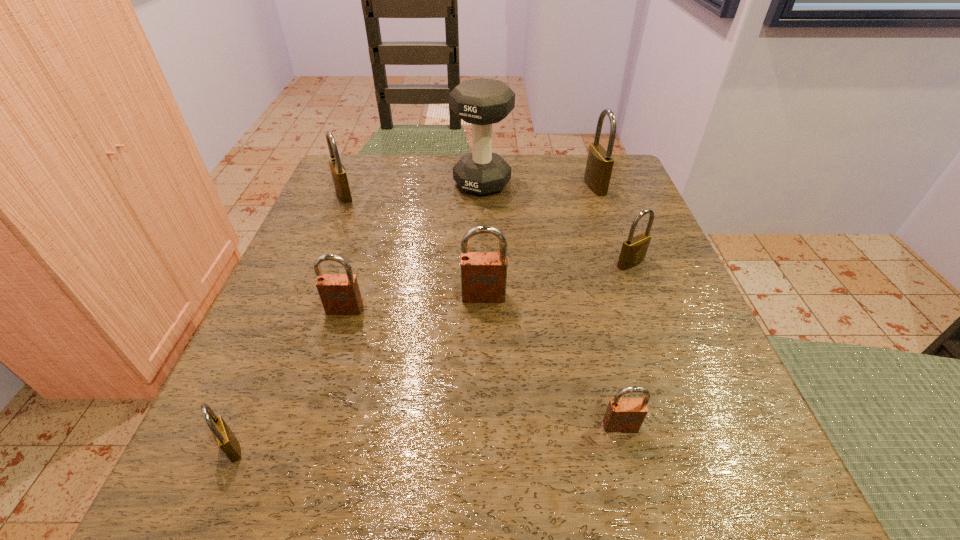
You are a GUI agent. You are given a task and a screenshot of the screen. Output one action in this format:
    pyautogui.click(x=<x>, y=<y>)
    Task: Click on the tallest object
    
    Given the screenshot: What is the action you would take?
    pyautogui.click(x=481, y=102)

At what (x,y) coordinates should I click in order to perform the action: click on gray dumbbell. Please return your answer as a coordinate pair (x, y). This screenshot has height=540, width=960. Looking at the image, I should click on (481, 102).

Where is `the seventh shortest object`? Image resolution: width=960 pixels, height=540 pixels. the seventh shortest object is located at coordinates point(599,165).

I want to click on the tallest padlock, so click(x=599, y=165).

Locate an element on the screen. the third smallest brass padlock is located at coordinates (338, 171).

At what (x,y) coordinates should I click in order to perform the action: click on the farthest brown padlock. Please return your answer as a coordinate pair (x, y). The width and height of the screenshot is (960, 540). Looking at the image, I should click on (483, 274).

Where is `the fourth farthest padlock`? The height and width of the screenshot is (540, 960). the fourth farthest padlock is located at coordinates (483, 274).

The image size is (960, 540). In order to click on the third nearest object in this screenshot , I will do `click(340, 295)`.

Locate an element on the screen. The width and height of the screenshot is (960, 540). the sixth object from right to left is located at coordinates (340, 295).

At what (x,y) coordinates should I click in order to perform the action: click on the fourth farthest object. Please return your answer as a coordinate pair (x, y). Looking at the image, I should click on (634, 249).